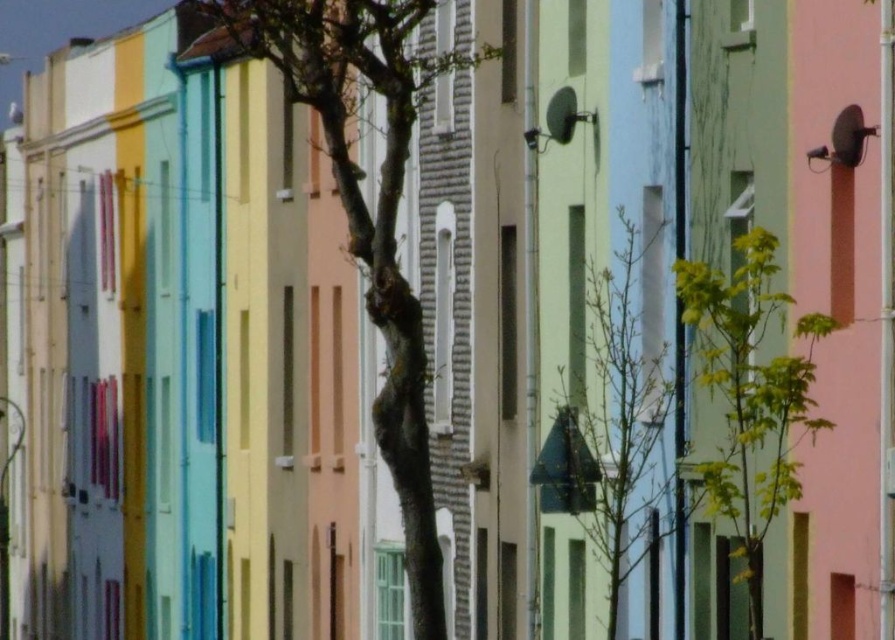
Describe the element at coordinates (616, 433) in the screenshot. I see `green leafy tree at center` at that location.

Can you confirm if green leafy tree at center is smaller than green leafy tree at right?

No.

The width and height of the screenshot is (895, 640). Describe the element at coordinates (616, 433) in the screenshot. I see `green leafy tree at center` at that location.

Identify the location of green leafy tree at center. This screenshot has height=640, width=895. (616, 433).

Which is in front, point (303, 97) or point (764, 522)?

Point (303, 97) is in front.

Based on the photo, who is shorter, smooth bark tree at center or green leafy tree at right?

With less height is green leafy tree at right.

Which is behind, point (378, 17) or point (766, 285)?

The point (766, 285) is more distant.

Find the location of a particular element. The width and height of the screenshot is (895, 640). smooth bark tree at center is located at coordinates (367, 211).

Is smooth bark tree at center positioned before green leafy tree at center?

Yes, it is.

Can you confirm if smooth bark tree at center is positioned to the right of green leafy tree at center?

Incorrect, smooth bark tree at center is not on the right side of green leafy tree at center.

The height and width of the screenshot is (640, 895). What are the coordinates of `smooth bark tree at center` in the screenshot? It's located at [367, 211].

The width and height of the screenshot is (895, 640). In order to click on smooth bark tree at center in this screenshot , I will do `click(367, 211)`.